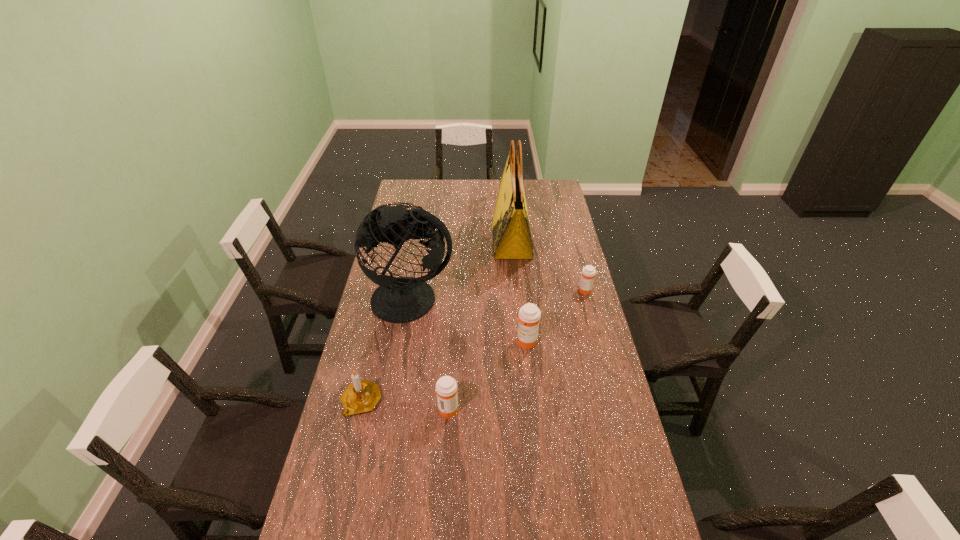
Find the location of `blank area located 0.400m on the front of the second medicine from left to right`. blank area located 0.400m on the front of the second medicine from left to right is located at coordinates (538, 454).

This screenshot has height=540, width=960. Identify the location of free region located on the left of the shortest medicine. (516, 291).

You are a GUI agent. You are given a task and a screenshot of the screen. Output one action in this format:
    pyautogui.click(x=<x>, y=<y>)
    Task: Click on the vacant region located on the front-facing side of the tote bag
    The image size is (960, 540).
    Given the screenshot: What is the action you would take?
    pyautogui.click(x=444, y=242)

Where is `free region located 0.180m on the front-facing side of the tote bag`? The width and height of the screenshot is (960, 540). free region located 0.180m on the front-facing side of the tote bag is located at coordinates pyautogui.click(x=456, y=242).

Identify the location of vacant point located 0.270m on the front-facing side of the tote bag. The height and width of the screenshot is (540, 960). (437, 242).

This screenshot has height=540, width=960. Identify the location of vacant space located 0.200m on the front-facing side of the globe. (399, 372).

Where is `vacant space located 0.120m on the front of the candle holder`? vacant space located 0.120m on the front of the candle holder is located at coordinates (348, 458).

Locate an element on the screen. The height and width of the screenshot is (540, 960). globe at the left edge is located at coordinates [404, 299].

Locate an element on the screen. This screenshot has width=960, height=540. candle holder situated at the left edge is located at coordinates (361, 396).

Where is `object that is positioned at the right edge`? object that is positioned at the right edge is located at coordinates (588, 272).